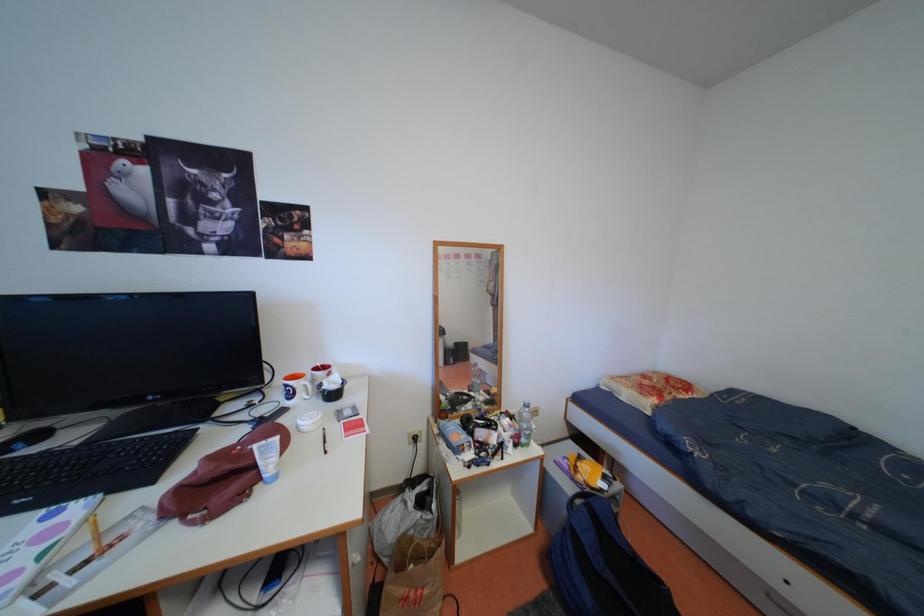
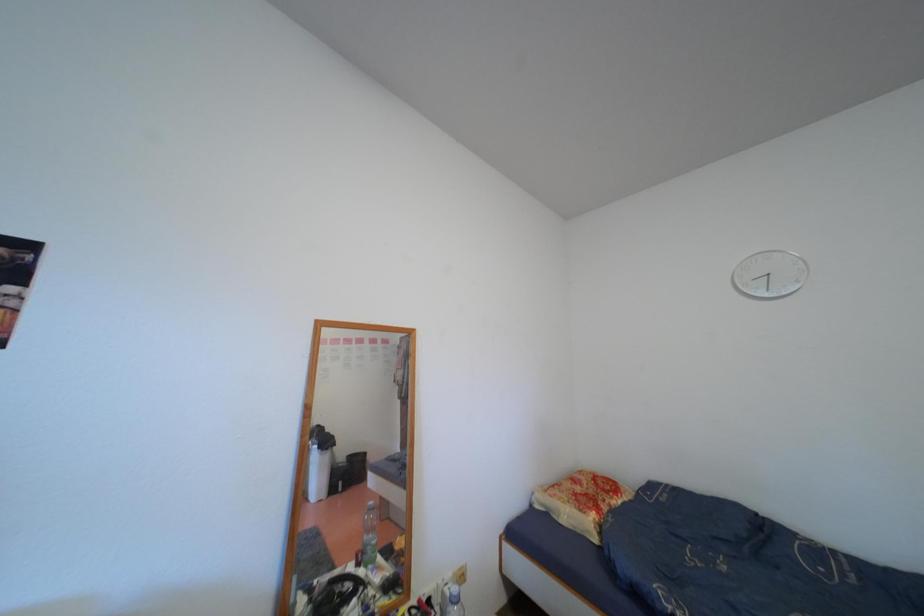
Based on the continuous images, in which direction is the camera rotating?

The camera's rotation is toward right-up.